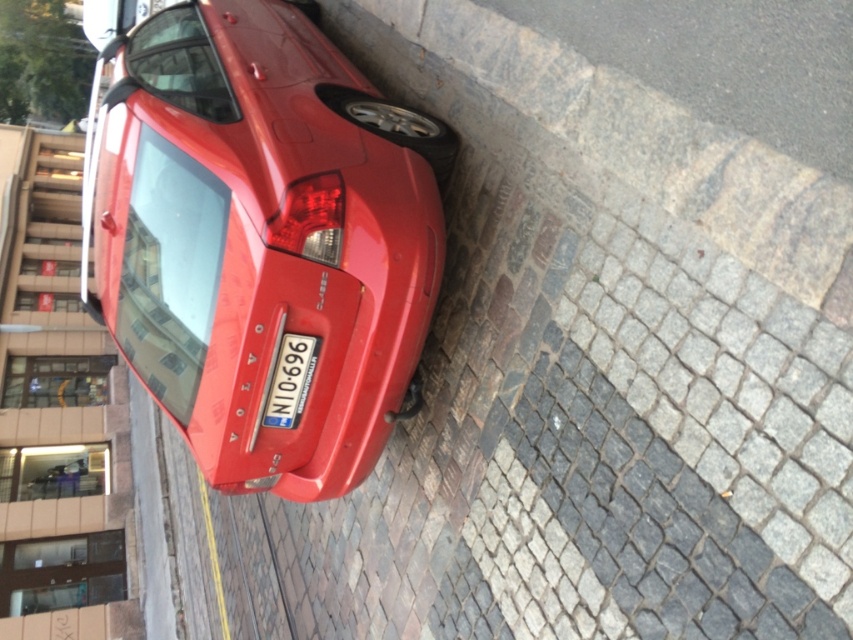
Question: Which point appears closest to the camera in this image?

Choices:
 (A) (285, 401)
 (B) (370, 294)

Answer: (B)

Question: Can you confirm if glossy red car at center is positioned below blue metallic license plate at center?

Choices:
 (A) yes
 (B) no

Answer: (B)

Question: Which object appears farthest from the camera in this image?

Choices:
 (A) glossy red car at center
 (B) blue metallic license plate at center

Answer: (B)

Question: Is glossy red car at center further to camera compared to blue metallic license plate at center?

Choices:
 (A) no
 (B) yes

Answer: (A)

Question: Which of the following is the closest to the observer?

Choices:
 (A) (305, 342)
 (B) (335, 280)

Answer: (B)

Question: Can you confirm if glossy red car at center is positioned below blue metallic license plate at center?

Choices:
 (A) no
 (B) yes

Answer: (A)